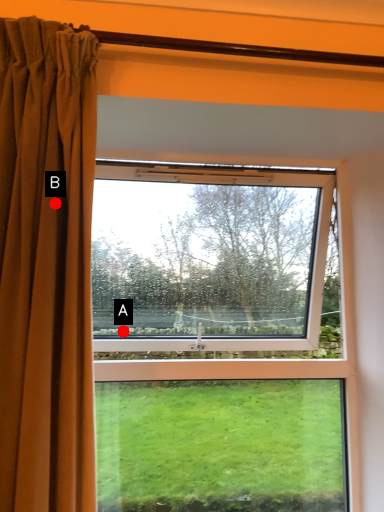
Question: Two points are circled on the image, labeled by A and B beside each circle. Which point appears closest to the camera in this image?

Choices:
 (A) A is closer
 (B) B is closer

Answer: (B)